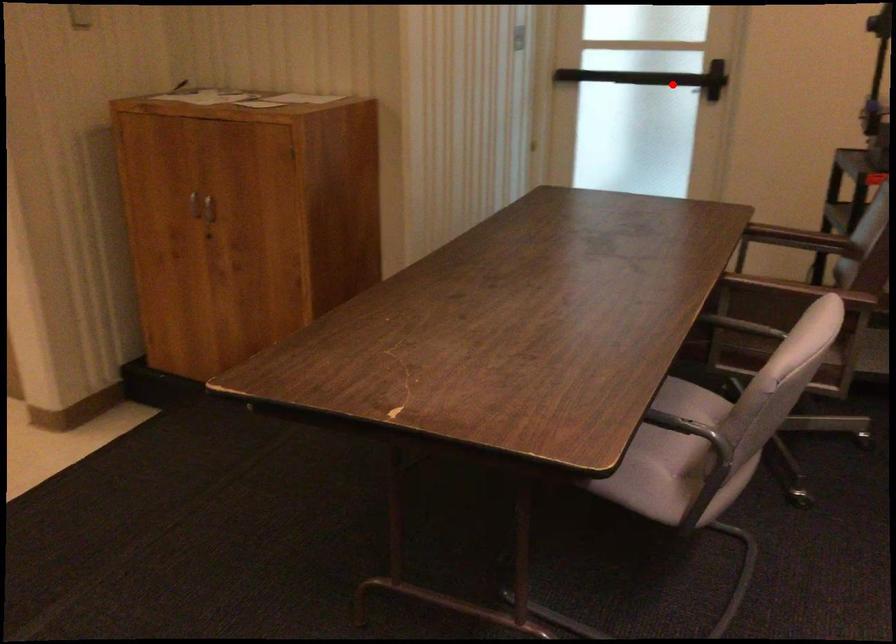
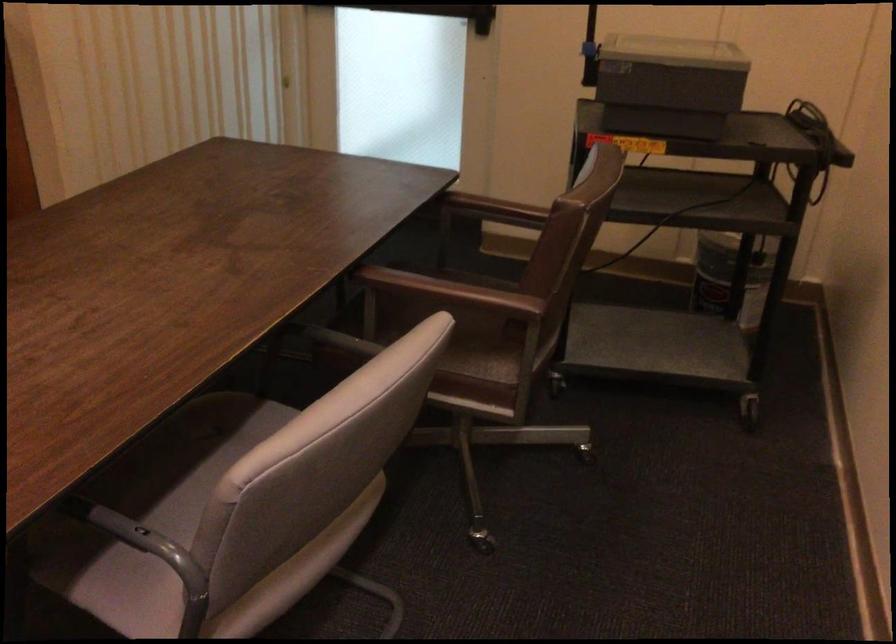
Locate, in the second image, the point that corresponds to the highlighted location in the first image.

(437, 12)